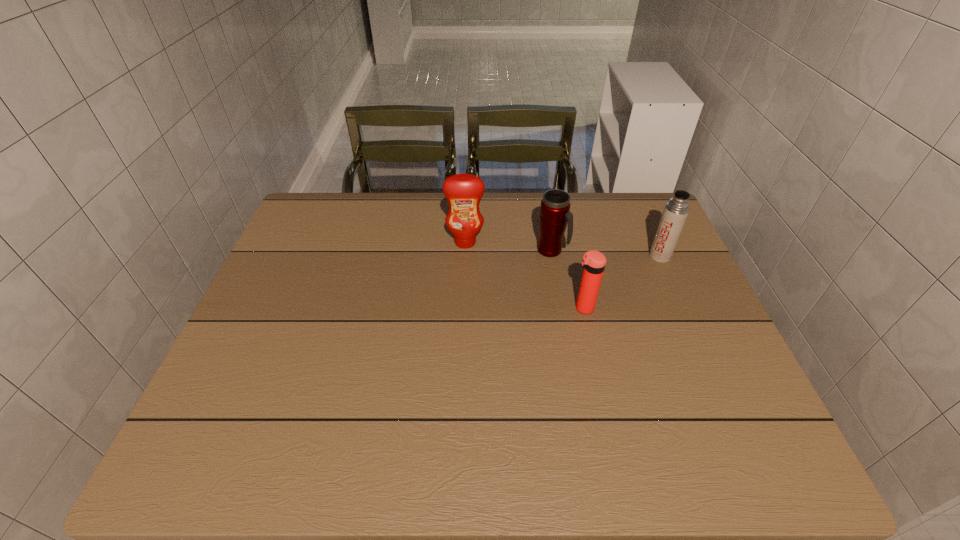
At what (x,y) coordinates should I click in order to perform the action: click on vacant space that satisfies the following two spatial constraints: 1. on the label side of the nearest thermos bottle; 2. on the right side of the leftmost object. Please return your answer as a coordinate pair (x, y). The image size is (960, 540). Looking at the image, I should click on (463, 308).